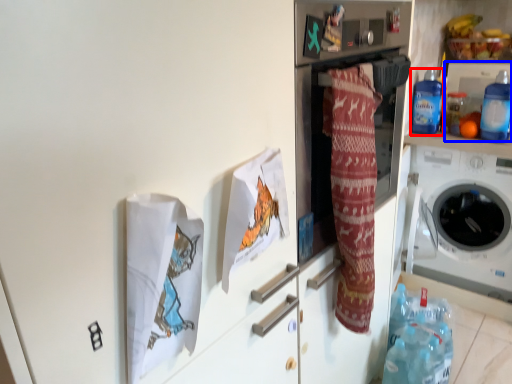
Question: Which object appears farthest to the camera in this image, bottle (highlighted by a red box) or appliance (highlighted by a blue box)?

Choices:
 (A) bottle
 (B) appliance

Answer: (B)